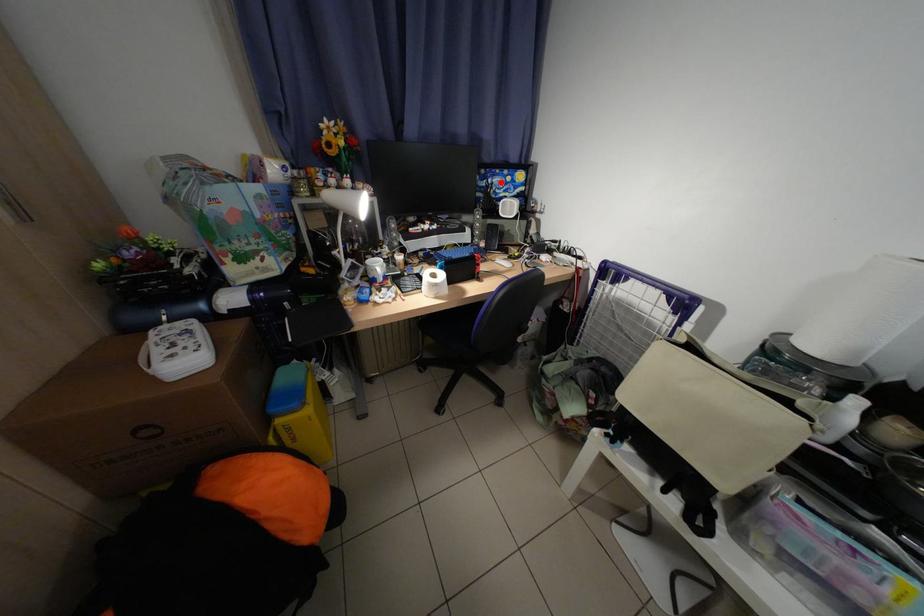
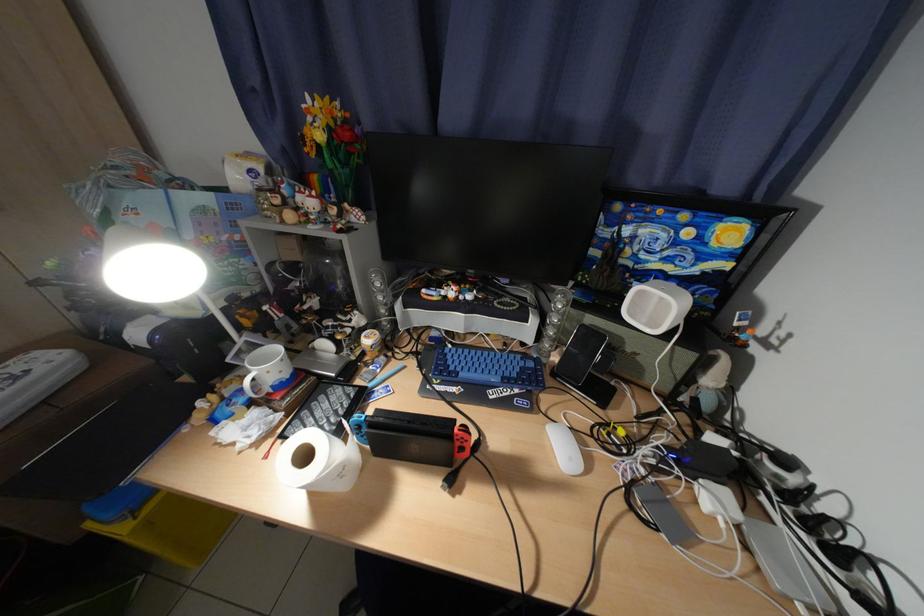
Question: A red point is marked in image1. In image2, is the corresponding 3D point closer to the camera or farther? Reply with the corresponding letter.

Choices:
 (A) The corresponding 3D point is closer.
 (B) The corresponding 3D point is farther.

Answer: (B)